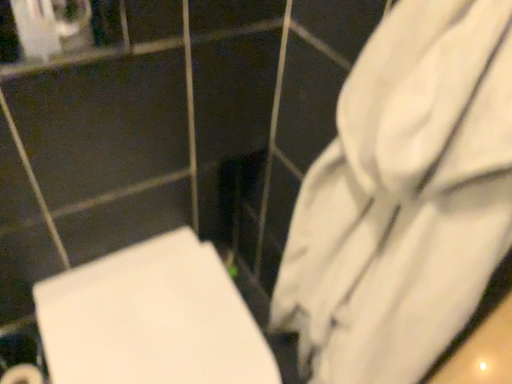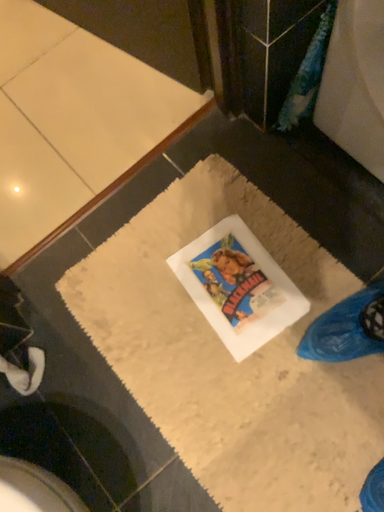
Question: Which way did the camera rotate in the video?

Choices:
 (A) rotated right
 (B) rotated left

Answer: (A)